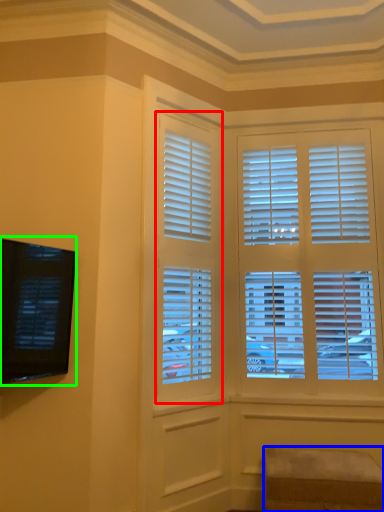
Question: Which is nearer to the window (highlighted by a red box)? furniture (highlighted by a blue box) or window screen (highlighted by a green box).

Choices:
 (A) furniture
 (B) window screen

Answer: (B)